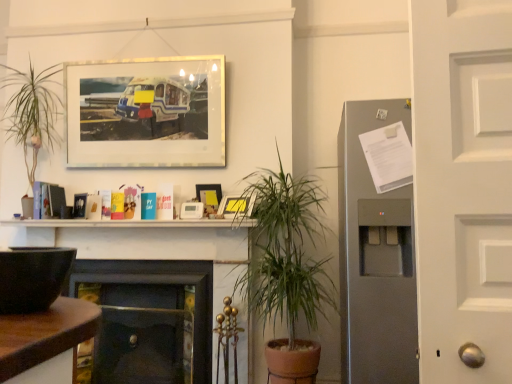
Question: Considering the relative sizes of matte glass picture frame at upper center, which ranks as the 3th picture frame in right-to-left order, and dark wood fireplace at center, which ranks as the first fireplace in left-to-right order, in the image provided, is matte glass picture frame at upper center, which ranks as the 3th picture frame in right-to-left order, taller than dark wood fireplace at center, which ranks as the first fireplace in left-to-right order,?

Choices:
 (A) no
 (B) yes

Answer: (B)

Question: Is matte glass picture frame at upper center, which ranks as the 3th picture frame in right-to-left order, to the left of dark wood fireplace at center, which ranks as the third fireplace in right-to-left order, from the viewer's perspective?

Choices:
 (A) no
 (B) yes

Answer: (A)

Question: From the image's perspective, does matte glass picture frame at upper center, which ranks as the 3th picture frame in right-to-left order, appear lower than dark wood fireplace at center, which ranks as the third fireplace in right-to-left order?

Choices:
 (A) no
 (B) yes

Answer: (A)

Question: Is matte glass picture frame at upper center, the first picture frame viewed from the left, shorter than dark wood fireplace at center, which ranks as the third fireplace in right-to-left order?

Choices:
 (A) no
 (B) yes

Answer: (A)

Question: Does matte glass picture frame at upper center, which ranks as the 3th picture frame in right-to-left order, have a greater width compared to dark wood fireplace at center, which ranks as the first fireplace in left-to-right order?

Choices:
 (A) yes
 (B) no

Answer: (B)

Question: Does matte glass picture frame at upper center, the first picture frame in the top-to-bottom sequence, have a smaller size compared to dark wood fireplace at center, which ranks as the first fireplace in left-to-right order?

Choices:
 (A) yes
 (B) no

Answer: (A)

Question: Does green leafy plant at center appear on the left side of matte wooden picture frame at center, the second picture frame in the top-to-bottom sequence?

Choices:
 (A) no
 (B) yes

Answer: (A)

Question: Considering the relative sizes of green leafy plant at center and matte wooden picture frame at center, marked as the 2th picture frame in a bottom-to-top arrangement, in the image provided, is green leafy plant at center thinner than matte wooden picture frame at center, marked as the 2th picture frame in a bottom-to-top arrangement,?

Choices:
 (A) no
 (B) yes

Answer: (A)

Question: Considering the relative positions of green leafy plant at center and matte wooden picture frame at center, marked as the 2th picture frame in a bottom-to-top arrangement, in the image provided, is green leafy plant at center behind matte wooden picture frame at center, marked as the 2th picture frame in a bottom-to-top arrangement,?

Choices:
 (A) no
 (B) yes

Answer: (A)

Question: Is green leafy plant at center surrounding matte wooden picture frame at center, marked as the 2th picture frame in a bottom-to-top arrangement?

Choices:
 (A) yes
 (B) no

Answer: (B)

Question: From a real-world perspective, is green leafy plant at center physically above matte wooden picture frame at center, placed as the 2th picture frame when sorted from left to right?

Choices:
 (A) yes
 (B) no

Answer: (B)

Question: Can you confirm if green leafy plant at center is wider than matte wooden picture frame at center, marked as the 2th picture frame in a bottom-to-top arrangement?

Choices:
 (A) yes
 (B) no

Answer: (A)

Question: Is matte black bowl at left wider than dark wood fireplace at center, which ranks as the third fireplace in right-to-left order?

Choices:
 (A) no
 (B) yes

Answer: (B)